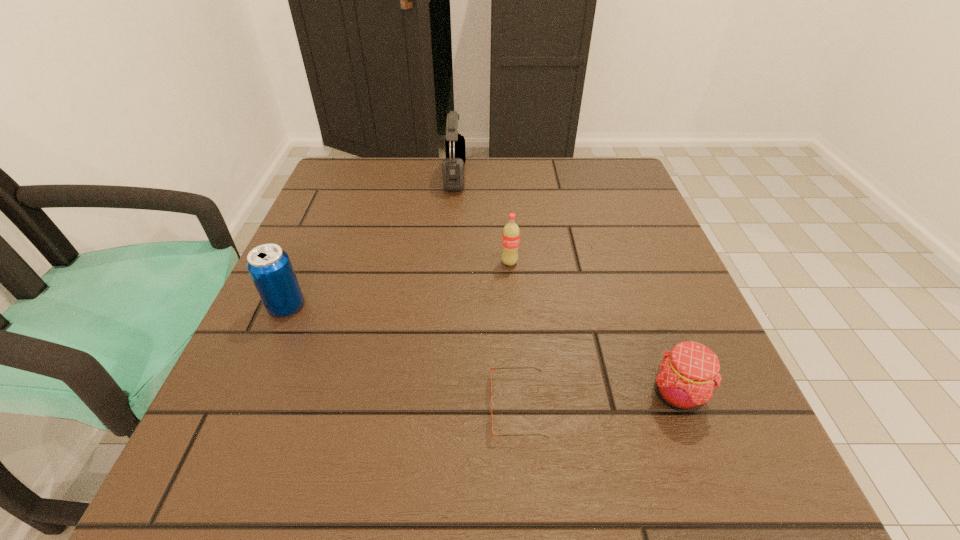
Find the location of a particular element. The height and width of the screenshot is (540, 960). free space at the near edge of the desktop is located at coordinates (616, 477).

Locate an element on the screen. The height and width of the screenshot is (540, 960). vacant space at the left edge of the desktop is located at coordinates (284, 343).

Find the location of `vacant space at the right edge of the desktop`. vacant space at the right edge of the desktop is located at coordinates (700, 416).

Image resolution: width=960 pixels, height=540 pixels. In the image, there is a desktop. What are the coordinates of `free space at the far left corner` in the screenshot? It's located at (344, 185).

Locate an element on the screen. Image resolution: width=960 pixels, height=540 pixels. vacant space at the far right corner is located at coordinates (631, 174).

Find the location of `free space between the leftmost object and the headset`. free space between the leftmost object and the headset is located at coordinates (371, 241).

The width and height of the screenshot is (960, 540). In order to click on free area in between the tallest object and the farther soda in this screenshot , I will do `click(482, 219)`.

Where is `free area in between the fourth tallest object and the nearer soda`? This screenshot has height=540, width=960. free area in between the fourth tallest object and the nearer soda is located at coordinates (482, 350).

Find the location of a particular element. This screenshot has height=540, width=960. free area in between the nearer soda and the sunglasses is located at coordinates (402, 356).

In order to click on vacant region between the sunglasses and the right soda in this screenshot , I will do `click(514, 334)`.